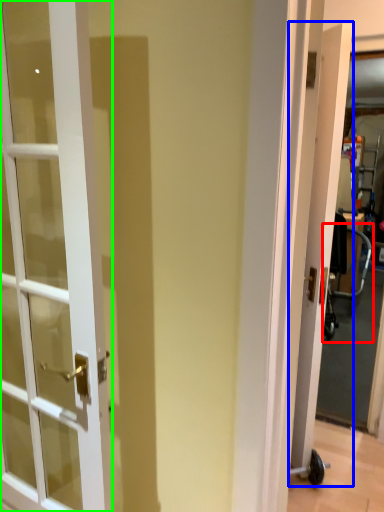
Question: Estimate the real-world distances between objects in this image. Which object is closer to baby carriage (highlighted by a red box), door (highlighted by a blue box) or door (highlighted by a green box)?

Choices:
 (A) door
 (B) door

Answer: (A)